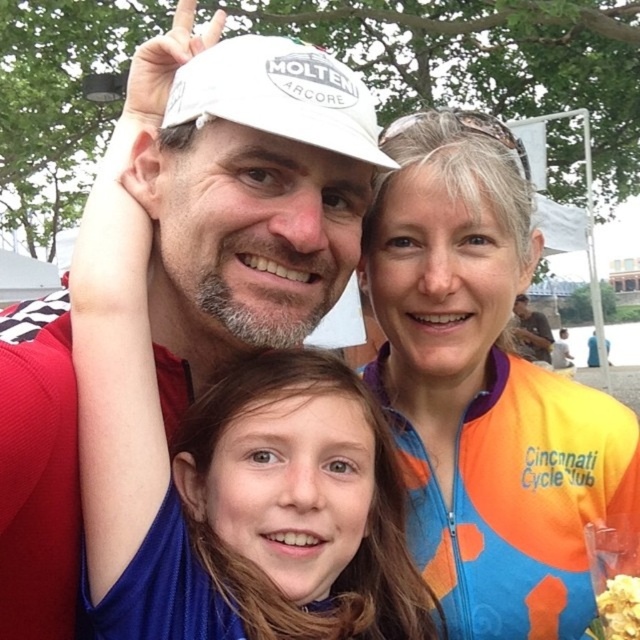
Does orange printed jersey at center appear on the right side of white matte baseball cap at upper center?

Indeed, orange printed jersey at center is positioned on the right side of white matte baseball cap at upper center.

This screenshot has height=640, width=640. What are the coordinates of `orange printed jersey at center` in the screenshot? It's located at (483, 388).

This screenshot has width=640, height=640. What are the coordinates of `orange printed jersey at center` in the screenshot? It's located at (483, 388).

Is orange printed jersey at center shorter than white matte cap at upper center?

Incorrect, orange printed jersey at center's height does not fall short of white matte cap at upper center's.

Does orange printed jersey at center have a lesser width compared to white matte cap at upper center?

Yes.

The image size is (640, 640). Identify the location of orange printed jersey at center. (483, 388).

You are a GUI agent. You are given a task and a screenshot of the screen. Output one action in this format:
    pyautogui.click(x=<x>, y=<y>)
    Task: Click on the orange printed jersey at center
    This screenshot has width=640, height=640.
    Given the screenshot: What is the action you would take?
    pyautogui.click(x=483, y=388)

Is white matte cap at upper center further to the viewer compared to white matte baseball cap at upper center?

No, it is in front of white matte baseball cap at upper center.

Is point (198, 252) positioned after point (180, 113)?

Yes, point (198, 252) is farther from viewer.

Is point (195, 240) positioned after point (250, 118)?

That is True.

Image resolution: width=640 pixels, height=640 pixels. I want to click on white matte cap at upper center, so click(x=253, y=204).